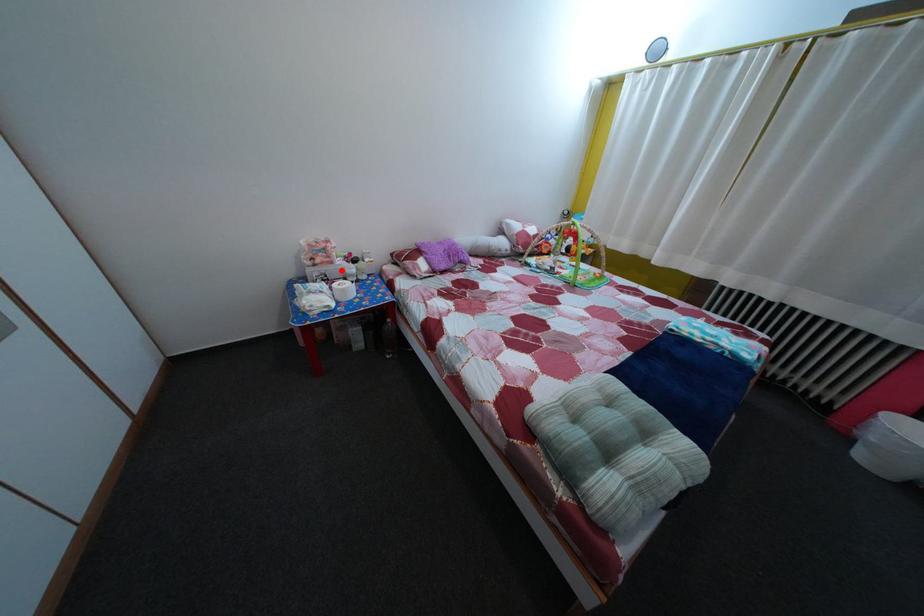
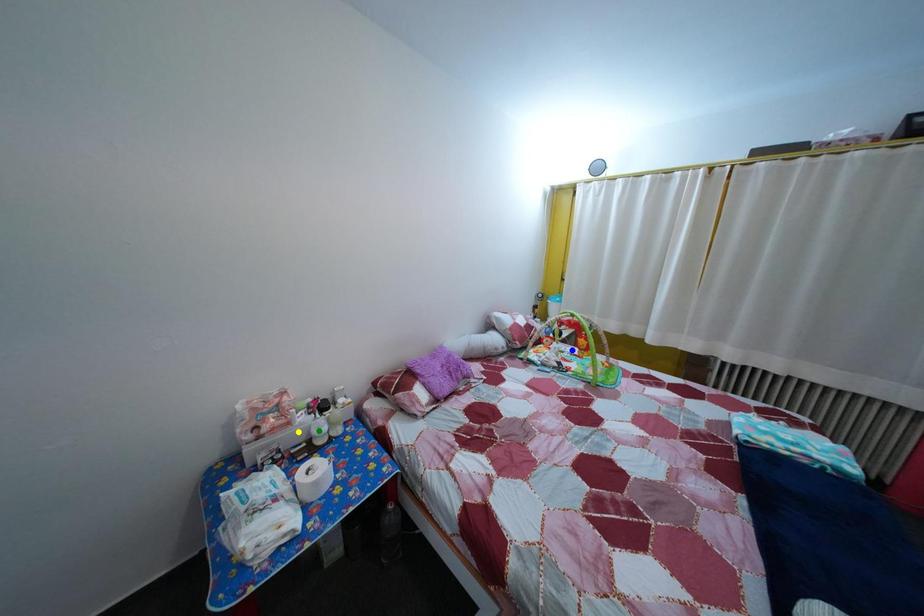
Question: I am providing you with two images of the same scene from different viewpoints. A red point is marked on the first image. You are given multiple points on the second image. Which point in image 2 represents the same 3d spot as the red point in image 1?

Choices:
 (A) yellow point
 (B) green point
 (C) blue point

Answer: (A)